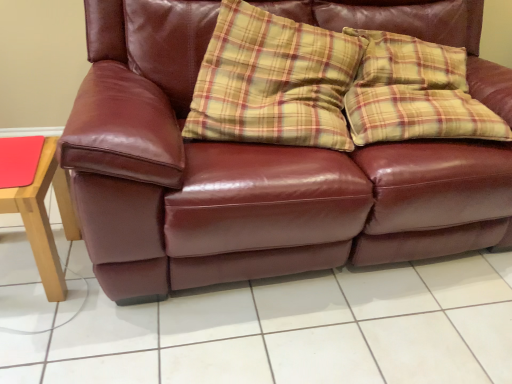
Locate an element on the screen. The height and width of the screenshot is (384, 512). vacant space underneath matte wood table at left (from a real-world perspective) is located at coordinates [x=26, y=271].